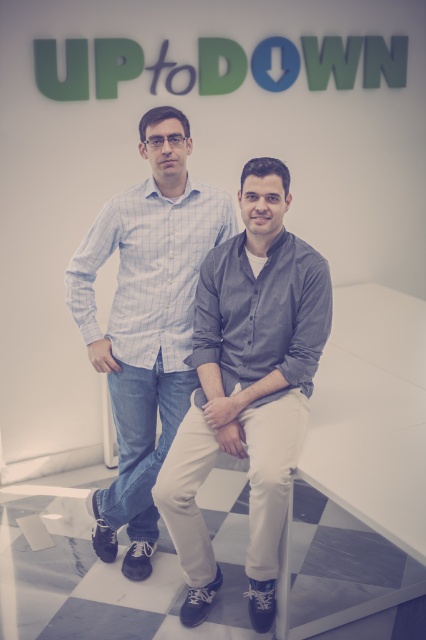
Question: Does dark gray cotton shirt at center have a larger size compared to blue checkered shirt at center?

Choices:
 (A) no
 (B) yes

Answer: (A)

Question: Can you confirm if dark gray cotton shirt at center is bigger than blue checkered shirt at center?

Choices:
 (A) no
 (B) yes

Answer: (A)

Question: Which object appears farthest from the camera in this image?

Choices:
 (A) dark gray cotton shirt at center
 (B) blue checkered shirt at center

Answer: (B)

Question: Is dark gray cotton shirt at center wider than blue checkered shirt at center?

Choices:
 (A) yes
 (B) no

Answer: (B)

Question: Which of the following is the farthest from the observer?

Choices:
 (A) dark gray cotton shirt at center
 (B) blue checkered shirt at center

Answer: (B)